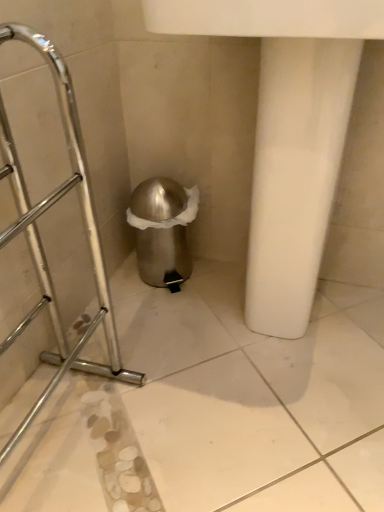
What do you see at coordinates (163, 230) in the screenshot? I see `polished metallic trash can at center` at bounding box center [163, 230].

You are a GUI agent. You are given a task and a screenshot of the screen. Output one action in this format:
    pyautogui.click(x=<x>, y=<y>)
    Task: Click on the polished metallic trash can at center
    Image resolution: width=384 pixels, height=512 pixels.
    Given the screenshot: What is the action you would take?
    pyautogui.click(x=163, y=230)

Locate an element on the screen. This screenshot has width=384, height=512. polished metallic trash can at center is located at coordinates [163, 230].